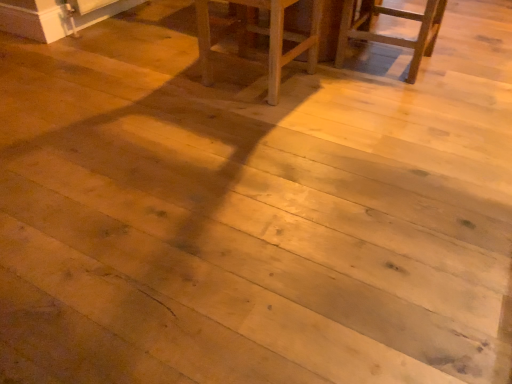
Question: Considering the positions of wooden chair at upper right and wooden chair at center in the image, is wooden chair at upper right wider or thinner than wooden chair at center?

Choices:
 (A) wide
 (B) thin

Answer: (A)

Question: In the image, is wooden chair at upper right positioned in front of or behind wooden chair at center?

Choices:
 (A) behind
 (B) front

Answer: (A)

Question: Is wooden chair at upper right to the left or to the right of wooden chair at center in the image?

Choices:
 (A) right
 (B) left

Answer: (A)

Question: In terms of width, does wooden chair at center look wider or thinner when compared to wooden chair at upper right?

Choices:
 (A) thin
 (B) wide

Answer: (A)

Question: From the image's perspective, is wooden chair at center positioned above or below wooden chair at upper right?

Choices:
 (A) above
 (B) below

Answer: (B)

Question: Is wooden chair at center inside or outside of wooden chair at upper right?

Choices:
 (A) outside
 (B) inside

Answer: (A)

Question: From a real-world perspective, is wooden chair at center physically located above or below wooden chair at upper right?

Choices:
 (A) above
 (B) below

Answer: (A)